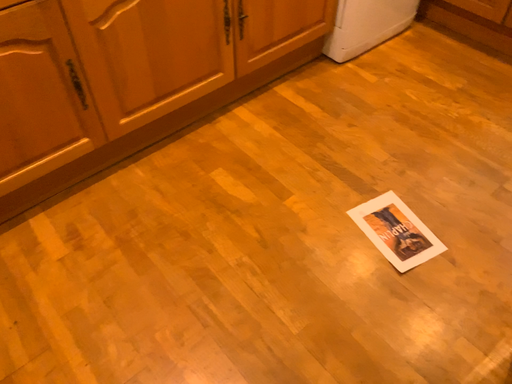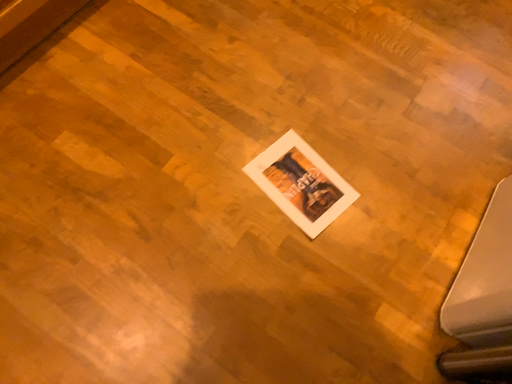
Question: Which way did the camera rotate in the video?

Choices:
 (A) rotated right
 (B) rotated left

Answer: (A)